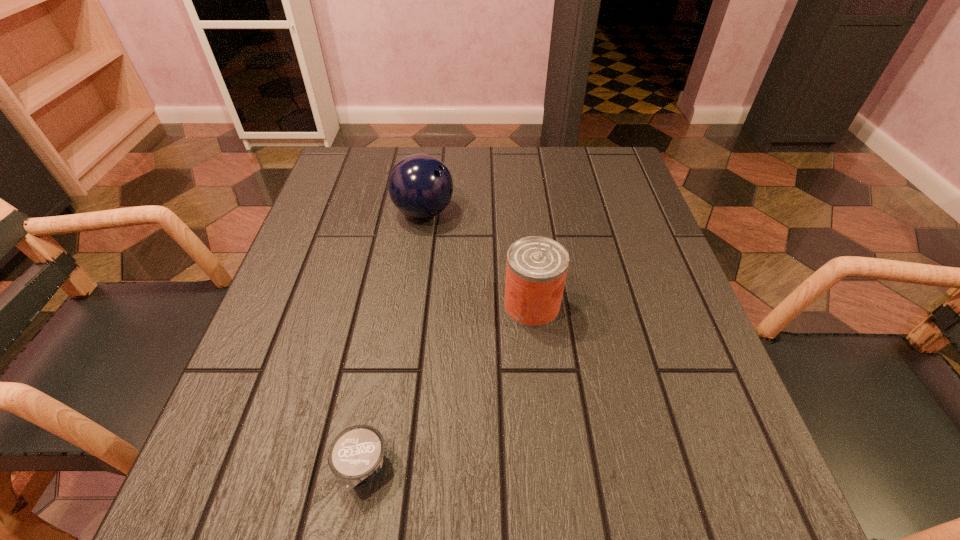
Find the location of a particular element. Image resolution: width=960 pixels, height=540 pixels. free space that satisfies the following two spatial constraints: 1. on the surface of the bowling ball near the finger holes; 2. on the left side of the second farthest object is located at coordinates (411, 306).

Identify the location of free spot that satisfies the following two spatial constraints: 1. on the surface of the can near the finger holes; 2. on the left side of the bowling ball. This screenshot has width=960, height=540. (411, 306).